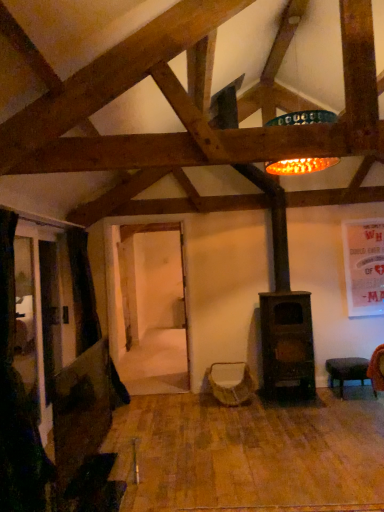
You are a GUI agent. You are given a task and a screenshot of the screen. Output one action in this format:
    pyautogui.click(x=<x>, y=<y>)
    Task: Click on the woven fabric swivel chair at center
    The width and height of the screenshot is (384, 512).
    Given the screenshot: What is the action you would take?
    pyautogui.click(x=231, y=382)

From the image's perspective, which one is positioned higher, black fabric curtain at left or black leather stool at lower right?

From the image's view, black fabric curtain at left is above.

Is black fabric curtain at left surrounding black leather stool at lower right?

Definitely not — black leather stool at lower right is not inside black fabric curtain at left.

Is black fabric curtain at left placed right next to black leather stool at lower right?

No, black fabric curtain at left is not beside black leather stool at lower right.

Does point (47, 490) come behind point (341, 380)?

No, (47, 490) is in front of (341, 380).

From the image's perspective, is woven fabric swivel chair at center above or below black fabric curtain at left?

woven fabric swivel chair at center is below black fabric curtain at left.

Is woven fabric swivel chair at center placed right next to black fabric curtain at left?

No, woven fabric swivel chair at center is not beside black fabric curtain at left.

Who is bigger, woven fabric swivel chair at center or black fabric curtain at left?

black fabric curtain at left.

Considering the sizes of woven fabric swivel chair at center and black fabric curtain at left in the image, is woven fabric swivel chair at center wider or thinner than black fabric curtain at left?

Considering their sizes, woven fabric swivel chair at center looks broader than black fabric curtain at left.

From the image's perspective, is black fabric curtain at left over woven fabric swivel chair at center?

Yes, from the image's perspective, black fabric curtain at left is above woven fabric swivel chair at center.

Does black fabric curtain at left have a lesser height compared to woven fabric swivel chair at center?

→ Incorrect, the height of black fabric curtain at left does not fall short of that of woven fabric swivel chair at center.

Is black fabric curtain at left outside of woven fabric swivel chair at center?

Yes.

This screenshot has height=512, width=384. I want to click on curtain in front of the woven fabric swivel chair at center, so click(18, 405).

Does woven fabric swivel chair at center have a lesser width compared to black leather stool at lower right?

Incorrect, the width of woven fabric swivel chair at center is not less than that of black leather stool at lower right.

Measure the distance from woven fabric swivel chair at center to black leather stool at lower right.

They are 1.04 meters apart.

Find the location of `swivel chair to the left of black leather stool at lower right`. swivel chair to the left of black leather stool at lower right is located at coordinates (231, 382).

Is woven fabric swivel chair at center beside black leather stool at lower right?

No, woven fabric swivel chair at center is not next to black leather stool at lower right.

Is black leather stool at lower right with woven fabric swivel chair at center?

No, black leather stool at lower right is not beside woven fabric swivel chair at center.

Does point (351, 373) appear closer or farther from the camera than point (239, 365)?

Point (351, 373) is positioned closer to the camera compared to point (239, 365).

Is black leather stool at lower right positioned with its back to woven fabric swivel chair at center?

No, black leather stool at lower right's orientation is not away from woven fabric swivel chair at center.

Looking at this image, is black leather stool at lower right surrounding woven fabric swivel chair at center?

No, black leather stool at lower right does not contain woven fabric swivel chair at center.

Is black leather stool at lower right aimed at black fabric curtain at left?

No, black leather stool at lower right is not aimed at black fabric curtain at left.

Which object is further away from the camera, black leather stool at lower right or black fabric curtain at left?

black leather stool at lower right.

In terms of width, does black leather stool at lower right look wider or thinner when compared to black fabric curtain at left?

Clearly, black leather stool at lower right has more width compared to black fabric curtain at left.

Does black leather stool at lower right have a larger size compared to black fabric curtain at left?

Actually, black leather stool at lower right might be smaller than black fabric curtain at left.

Where is `furniture behind the black fabric curtain at left`? This screenshot has height=512, width=384. furniture behind the black fabric curtain at left is located at coordinates (346, 371).

The height and width of the screenshot is (512, 384). I want to click on swivel chair on the right of black fabric curtain at left, so point(231,382).

Based on their spatial positions, is black fabric curtain at left or woven fabric swivel chair at center closer to black leather stool at lower right?

Based on the image, woven fabric swivel chair at center appears to be nearer to black leather stool at lower right.

Looking at this image, considering their positions, is black fabric curtain at left positioned closer to woven fabric swivel chair at center than black leather stool at lower right?

Among the two, black leather stool at lower right is located nearer to woven fabric swivel chair at center.

Based on the photo, from the image, which object appears to be farther from black leather stool at lower right, woven fabric swivel chair at center or black fabric curtain at left?

The object further to black leather stool at lower right is black fabric curtain at left.

From the image, which object appears to be farther from black fabric curtain at left, black leather stool at lower right or woven fabric swivel chair at center?

black leather stool at lower right.

Based on their spatial positions, is woven fabric swivel chair at center or black leather stool at lower right closer to black fabric curtain at left?

Based on the image, woven fabric swivel chair at center appears to be nearer to black fabric curtain at left.

When comparing their distances from woven fabric swivel chair at center, does black leather stool at lower right or black fabric curtain at left seem further?

black fabric curtain at left is positioned further to the anchor woven fabric swivel chair at center.

Where is `furniture between black fabric curtain at left and woven fabric swivel chair at center in the front-back direction`? furniture between black fabric curtain at left and woven fabric swivel chair at center in the front-back direction is located at coordinates (346, 371).